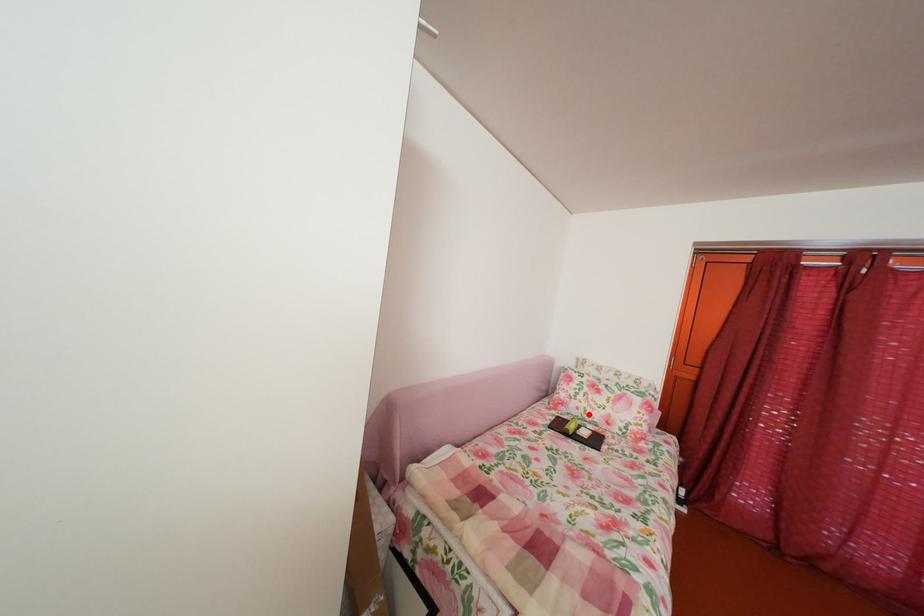
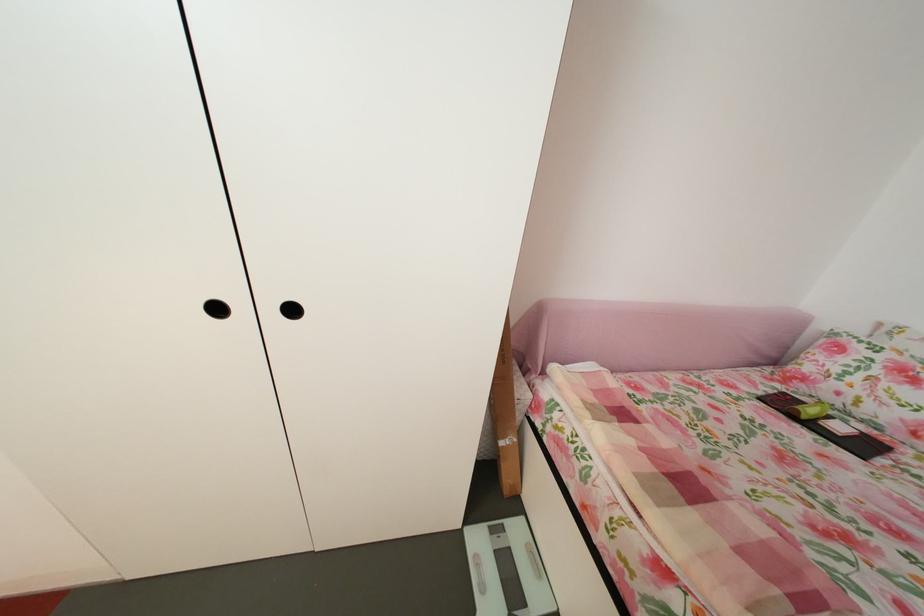
In the second image, find the point that corresponds to the highlighted location in the first image.

(849, 400)